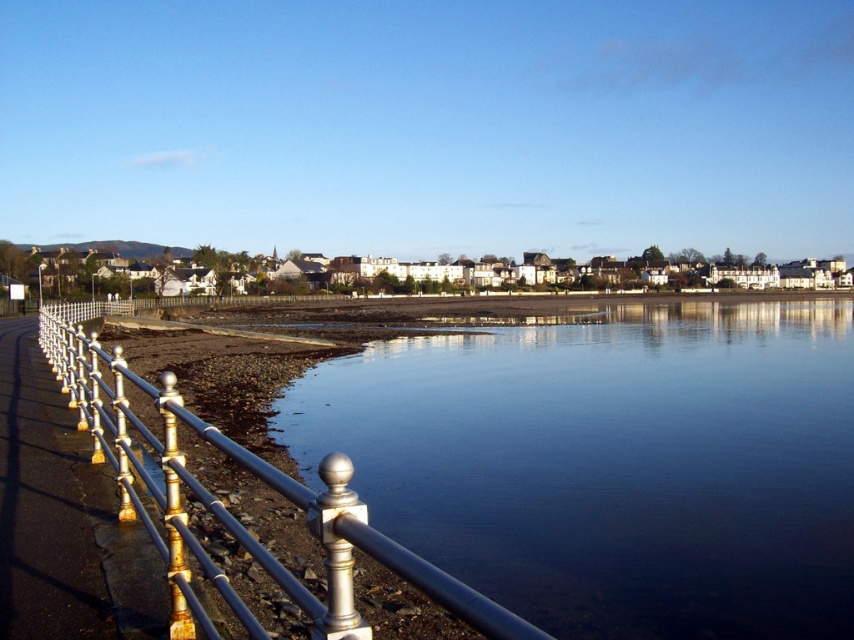
Does point (554, 492) lie in front of point (72, 497)?

No, (554, 492) is behind (72, 497).

Does clear glass water at center have a lesser width compared to metallic rail at left?

In fact, clear glass water at center might be wider than metallic rail at left.

Is point (839, 604) in front of point (30, 540)?

No, it is not.

Find the location of a particular element. clear glass water at center is located at coordinates (612, 464).

The width and height of the screenshot is (854, 640). What do you see at coordinates (612, 464) in the screenshot? I see `clear glass water at center` at bounding box center [612, 464].

Looking at this image, which of these two, clear glass water at center or silver/golden metal fence at left, stands shorter?

clear glass water at center is shorter.

Who is more distant from viewer, (729, 419) or (314, 602)?

The point (729, 419) is behind.

The image size is (854, 640). Identify the location of clear glass water at center. (612, 464).

Which of these two, silver/golden metal fence at left or metallic rail at left, stands taller?

Standing taller between the two is silver/golden metal fence at left.

Can you confirm if silver/golden metal fence at left is positioned to the right of metallic rail at left?

In fact, silver/golden metal fence at left is to the left of metallic rail at left.

At what (x,y) coordinates should I click in order to perform the action: click on silver/golden metal fence at left. Please return your answer as a coordinate pair (x, y). The image size is (854, 640). Looking at the image, I should click on coord(229,509).

This screenshot has width=854, height=640. Identify the location of silver/golden metal fence at left. (229, 509).